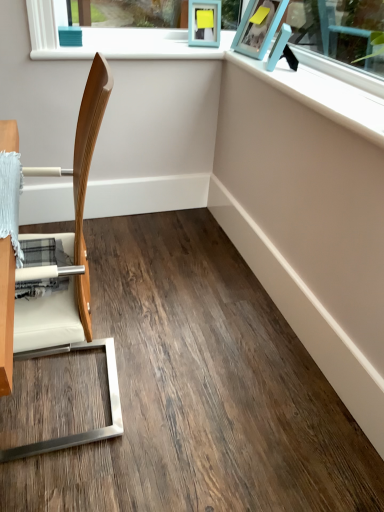
Image resolution: width=384 pixels, height=512 pixels. I want to click on spots to the right of wooden chair at left, so click(x=183, y=394).